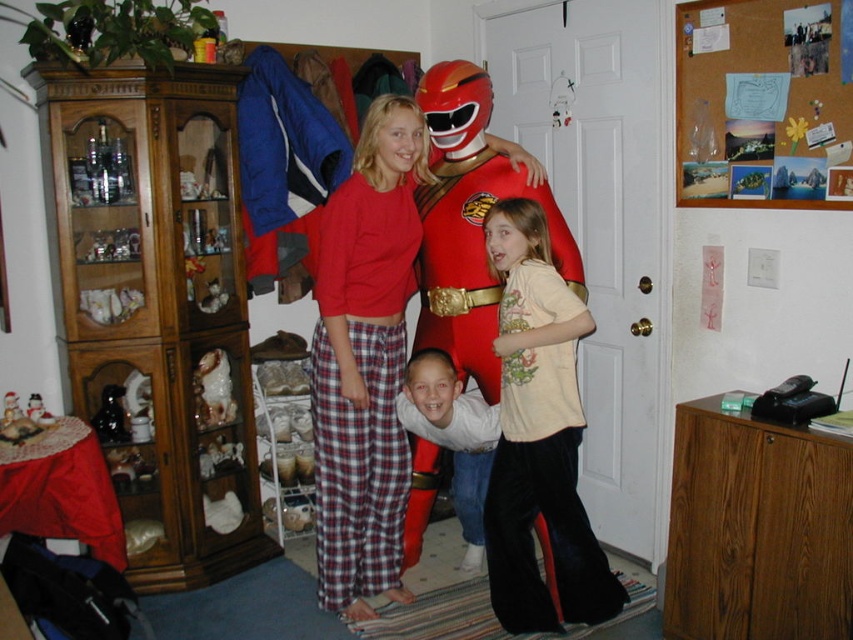
You are trying to figure out the spatial relationship between the light beige cotton shirt at center and the red shiny plastic costume at center. Which one is located above the other?

The light beige cotton shirt at center is positioned under the red shiny plastic costume at center, so the red shiny plastic costume at center is above the light beige cotton shirt at center.

You are a child who wants to reach the red shiny plastic costume at center to touch it. There is a red matte costume at center in the way. Which costume should you move first to get to the one you want?

You should move the red matte costume at center first because it is below the red shiny plastic costume at center, so removing it will allow access to the one above.